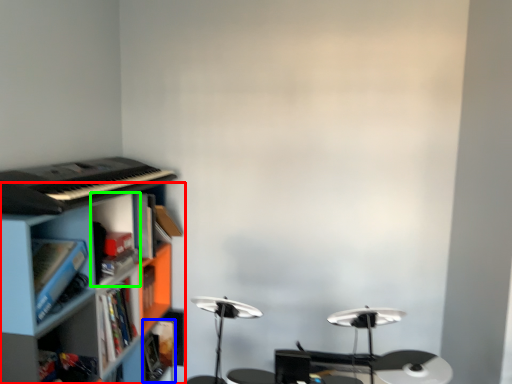
Question: Which object is the farthest from shelf (highlighted by a red box)? Choose among these: book (highlighted by a blue box) or cabinet (highlighted by a green box).

Choices:
 (A) book
 (B) cabinet

Answer: (A)